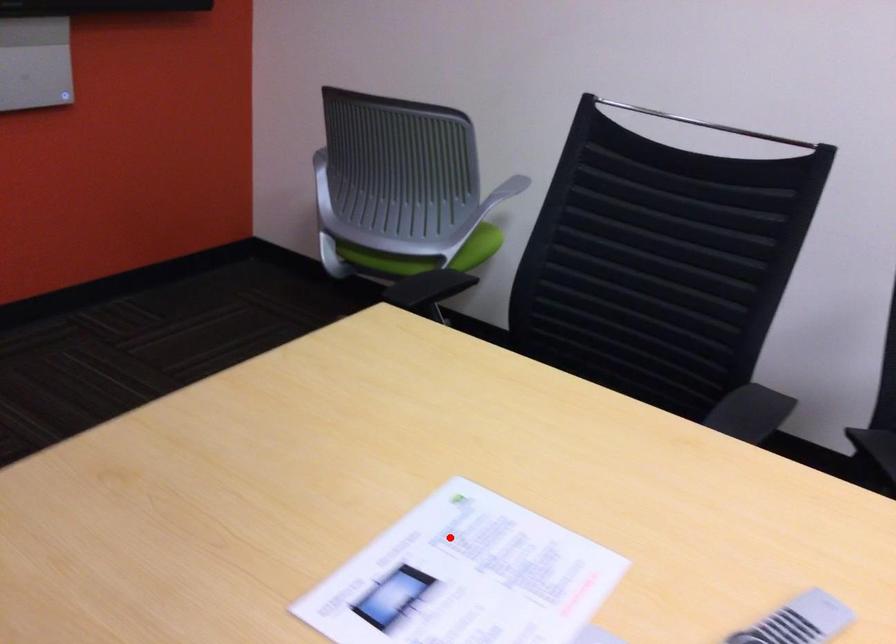
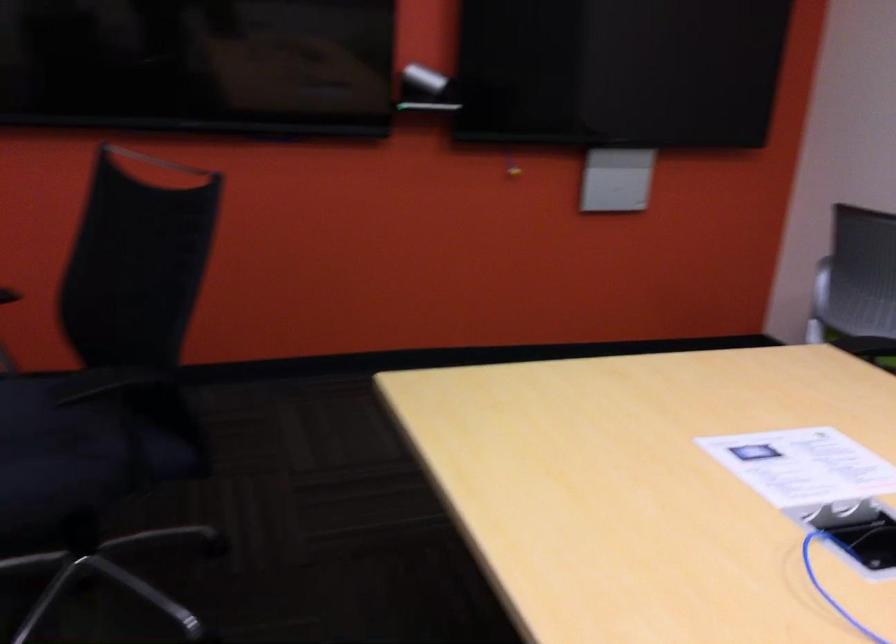
Question: I am providing you with two images of the same scene from different viewpoints. In image1, a red point is highlighted. Considering the same 3D point in image2, which of the following is correct?

Choices:
 (A) It is closer
 (B) It is farther

Answer: (B)